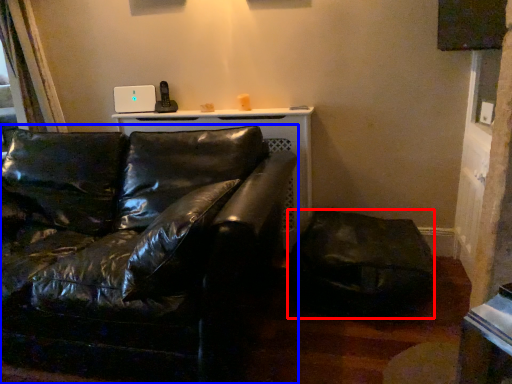
Question: Which point is closer to the camera, swivel chair (highlighted by a red box) or studio couch (highlighted by a blue box)?

Choices:
 (A) swivel chair
 (B) studio couch

Answer: (B)